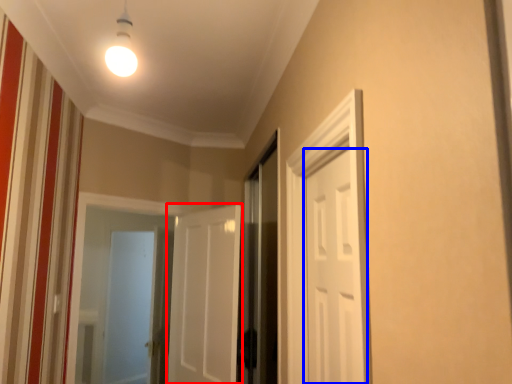
Question: Which of the following is the farthest to the observer, door (highlighted by a red box) or door (highlighted by a blue box)?

Choices:
 (A) door
 (B) door

Answer: (A)